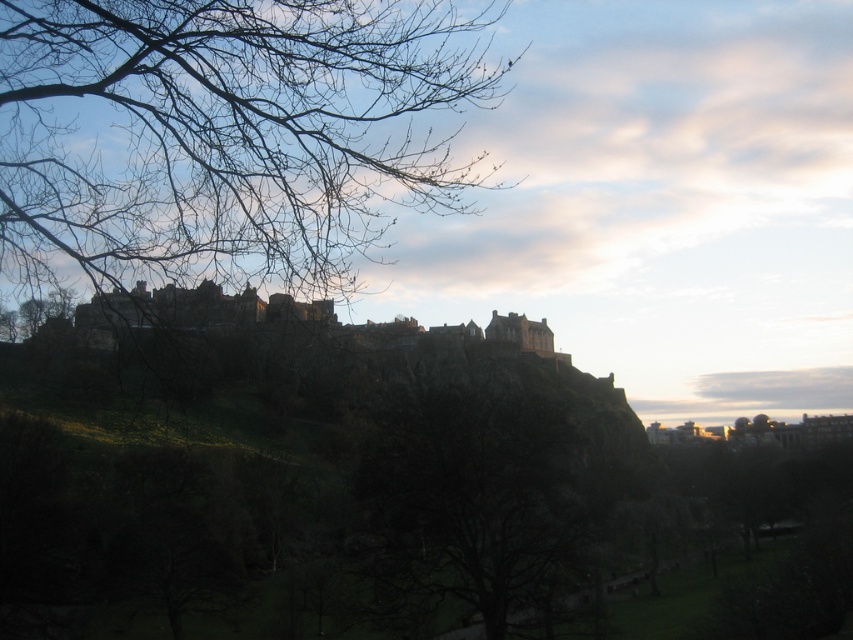
Question: Can you confirm if bare branches at upper left is positioned to the right of bare branches at center?

Choices:
 (A) yes
 (B) no

Answer: (B)

Question: Which point is closer to the camera?

Choices:
 (A) (144, 259)
 (B) (444, 451)

Answer: (A)

Question: Is bare branches at upper left bigger than bare branches at center?

Choices:
 (A) no
 (B) yes

Answer: (B)

Question: Is bare branches at upper left to the left of bare branches at center from the viewer's perspective?

Choices:
 (A) no
 (B) yes

Answer: (B)